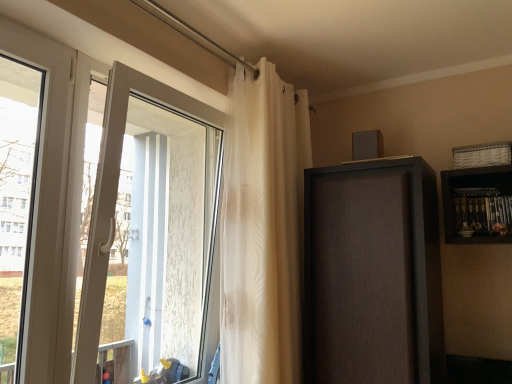
What do you see at coordinates (262, 228) in the screenshot? I see `translucent white curtain at upper center` at bounding box center [262, 228].

Where is `translucent white curtain at upper center`? translucent white curtain at upper center is located at coordinates (262, 228).

Locate an element on the screen. This screenshot has width=512, height=384. white glossy door at left is located at coordinates (150, 231).

Find the location of `white plastic window at left`. white plastic window at left is located at coordinates (52, 206).

Would you say matte brown cabinet at upper right is outside white plastic window at left?

Yes.

Is matte brown cabinet at upper right touching white plastic window at left?

No, matte brown cabinet at upper right is not with white plastic window at left.

Considering the relative positions of matte brown cabinet at upper right and white plastic window at left in the image provided, is matte brown cabinet at upper right to the right of white plastic window at left from the viewer's perspective?

Yes, matte brown cabinet at upper right is to the right of white plastic window at left.

From the image's perspective, does matte brown cabinet at upper right appear lower than white glossy door at left?

Yes, from the image's perspective, matte brown cabinet at upper right is beneath white glossy door at left.

Do you think matte brown cabinet at upper right is within white glossy door at left, or outside of it?

The correct answer is: outside.

Is matte brown cabinet at upper right next to white glossy door at left?

matte brown cabinet at upper right and white glossy door at left are not in contact.

Between white glossy door at left and white plastic window at left, which one has less height?

With less height is white plastic window at left.

Is white glossy door at left facing towards white plastic window at left?

No, white glossy door at left is not aimed at white plastic window at left.

From a real-world perspective, is white glossy door at left on white plastic window at left?

Incorrect, from a real-world perspective, white glossy door at left is lower than white plastic window at left.

From the image's perspective, is white glossy door at left positioned above or below white plastic window at left?

Clearly, from the image's perspective, white glossy door at left is below white plastic window at left.

Considering the positions of point (373, 333) and point (272, 329), is point (373, 333) closer or farther from the camera than point (272, 329)?

Point (373, 333).

Which object is closer to the camera taking this photo, matte brown cabinet at upper right or translucent white curtain at upper center?

Positioned in front is translucent white curtain at upper center.

Is matte brown cabinet at upper right taller than translucent white curtain at upper center?

No.

Find the location of a particular element. curtain above the matte brown cabinet at upper right (from the image's perspective) is located at coordinates (262, 228).

Considering the relative positions of translucent white curtain at upper center and white glossy door at left in the image provided, is translucent white curtain at upper center to the right of white glossy door at left from the viewer's perspective?

Yes, translucent white curtain at upper center is to the right of white glossy door at left.

From the image's perspective, which one is positioned lower, translucent white curtain at upper center or white glossy door at left?

translucent white curtain at upper center, from the image's perspective.

Are translucent white curtain at upper center and white glossy door at left located far from each other?

Actually, translucent white curtain at upper center and white glossy door at left are a little close together.

Can you confirm if translucent white curtain at upper center is thinner than white glossy door at left?

No, translucent white curtain at upper center is not thinner than white glossy door at left.

The width and height of the screenshot is (512, 384). In order to click on door that appears on the left of translucent white curtain at upper center in this screenshot , I will do `click(150, 231)`.

From the image's perspective, would you say white glossy door at left is positioned over translucent white curtain at upper center?

Yes.

In the scene shown: Would you say white glossy door at left is outside translucent white curtain at upper center?

Yes.

Is white glossy door at left turned away from translucent white curtain at upper center?

No, white glossy door at left is not facing away from translucent white curtain at upper center.

Would you say matte brown cabinet at upper right is part of white plastic window at left's contents?

No, matte brown cabinet at upper right is not surrounded by white plastic window at left.

Is white plastic window at left thinner than matte brown cabinet at upper right?

Yes.

How distant is white plastic window at left from matte brown cabinet at upper right?

3.93 feet.

Image resolution: width=512 pixels, height=384 pixels. Identify the location of screen door located below the white plastic window at left (from the image's perspective). (372, 274).

Find the location of a particular element. The width and height of the screenshot is (512, 384). door that appears on the left of matte brown cabinet at upper right is located at coordinates (150, 231).

Based on their spatial positions, is translucent white curtain at upper center or white glossy door at left closer to matte brown cabinet at upper right?

translucent white curtain at upper center is closer to matte brown cabinet at upper right.

Estimate the real-world distances between objects in this image. Which object is further from white glossy door at left, matte brown cabinet at upper right or white plastic window at left?

matte brown cabinet at upper right is positioned further to the anchor white glossy door at left.

Which object lies nearer to the anchor point white glossy door at left, translucent white curtain at upper center or matte brown cabinet at upper right?

translucent white curtain at upper center lies closer to white glossy door at left than the other object.

Which object lies further to the anchor point matte brown cabinet at upper right, white glossy door at left or translucent white curtain at upper center?

white glossy door at left is positioned further to the anchor matte brown cabinet at upper right.

When comparing their distances from matte brown cabinet at upper right, does white glossy door at left or white plastic window at left seem further?

Based on the image, white plastic window at left appears to be further to matte brown cabinet at upper right.

From the image, which object appears to be farther from translucent white curtain at upper center, matte brown cabinet at upper right or white glossy door at left?

Among the two, white glossy door at left is located further to translucent white curtain at upper center.

When comparing their distances from translucent white curtain at upper center, does white plastic window at left or matte brown cabinet at upper right seem closer?

matte brown cabinet at upper right is closer to translucent white curtain at upper center.

Considering their positions, is translucent white curtain at upper center positioned further to white plastic window at left than matte brown cabinet at upper right?

The object further to white plastic window at left is matte brown cabinet at upper right.

Find the location of a particular element. The height and width of the screenshot is (384, 512). door located between white plastic window at left and translucent white curtain at upper center in the left-right direction is located at coordinates (150, 231).

Identify the location of curtain located between white glossy door at left and matte brown cabinet at upper right in the left-right direction. Image resolution: width=512 pixels, height=384 pixels. (262, 228).

Where is `curtain between white plastic window at left and matte brown cabinet at upper right`? curtain between white plastic window at left and matte brown cabinet at upper right is located at coordinates 262,228.

Image resolution: width=512 pixels, height=384 pixels. Find the location of `door between white plastic window at left and matte brown cabinet at upper right from left to right`. door between white plastic window at left and matte brown cabinet at upper right from left to right is located at coordinates (150, 231).